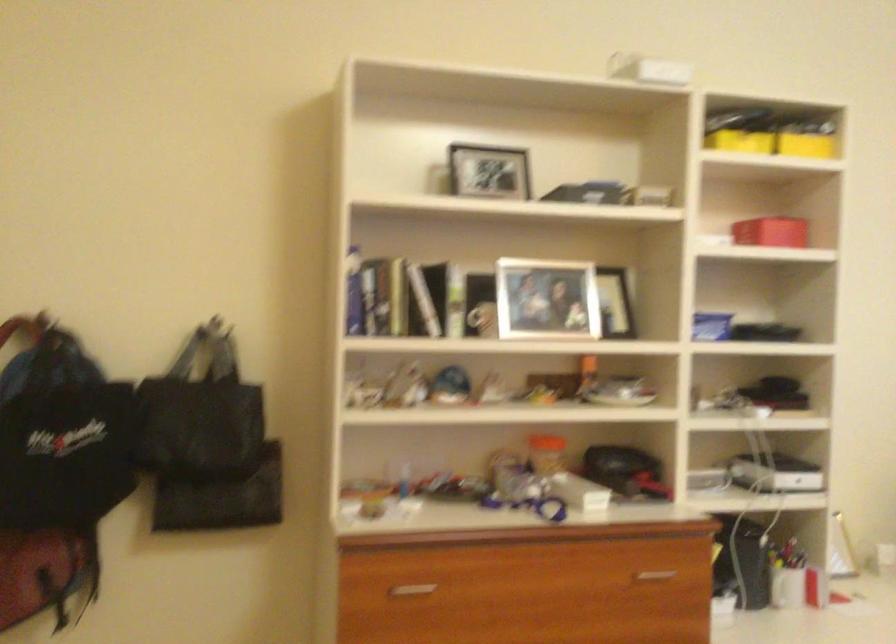
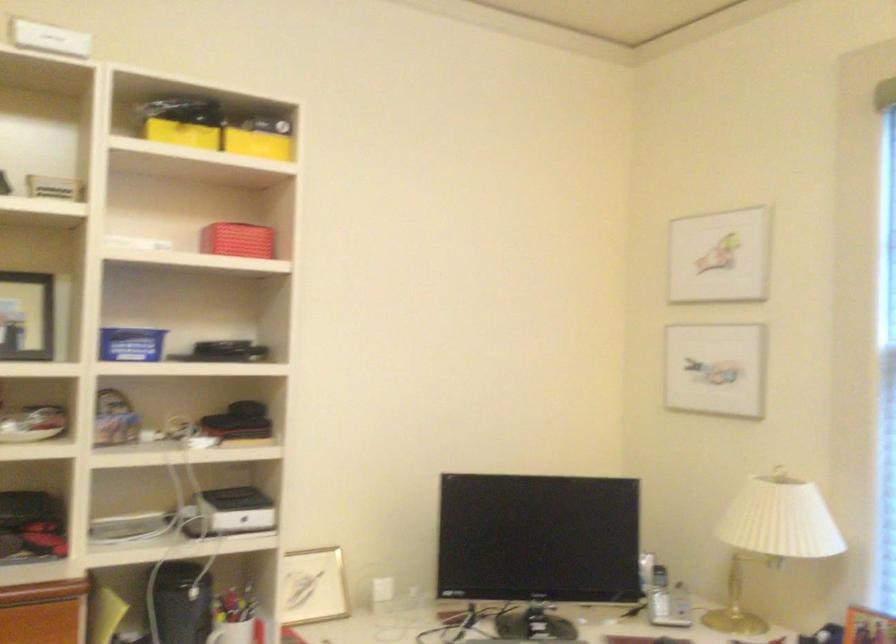
Question: In a continuous first-person perspective shot, in which direction is the camera moving?

Choices:
 (A) Left
 (B) Right
 (C) Forward
 (D) Backward

Answer: (B)